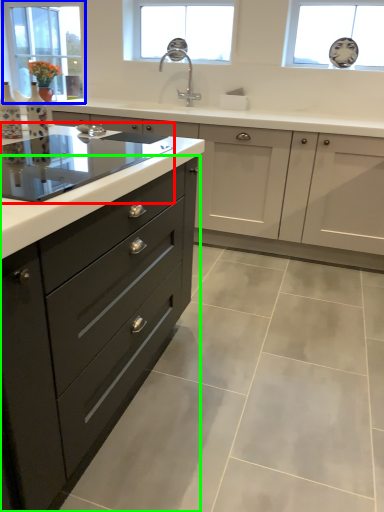
Question: Estimate the real-world distances between objects in this image. Which object is farther from home appliance (highlighted by a red box), window (highlighted by a blue box) or drawer (highlighted by a green box)?

Choices:
 (A) window
 (B) drawer

Answer: (A)